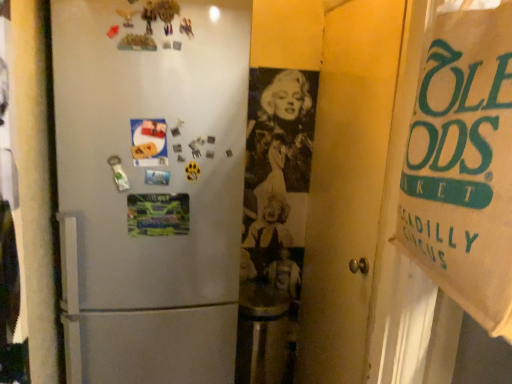
Question: Would you say matte paper postcard at center left, the second postcard positioned from the bottom, is part of brown paper bag at right's contents?

Choices:
 (A) no
 (B) yes

Answer: (A)

Question: Does brown paper bag at right turn towards matte paper postcard at center left, the second postcard positioned from the bottom?

Choices:
 (A) yes
 (B) no

Answer: (B)

Question: Is brown paper bag at right positioned with its back to matte paper postcard at center left, arranged as the 1th postcard when viewed from the top?

Choices:
 (A) no
 (B) yes

Answer: (A)

Question: Is brown paper bag at right to the right of matte paper postcard at center left, arranged as the 1th postcard when viewed from the top, from the viewer's perspective?

Choices:
 (A) yes
 (B) no

Answer: (A)

Question: From a real-world perspective, is brown paper bag at right positioned under matte paper postcard at center left, the second postcard positioned from the bottom, based on gravity?

Choices:
 (A) yes
 (B) no

Answer: (B)

Question: Considering the positions of multicolored paper at center, which is the 1th postcard in bottom-to-top order, and matte paper postcard at center left, the second postcard positioned from the bottom, in the image, is multicolored paper at center, which is the 1th postcard in bottom-to-top order, wider or thinner than matte paper postcard at center left, the second postcard positioned from the bottom,?

Choices:
 (A) wide
 (B) thin

Answer: (B)

Question: Is multicolored paper at center, which is counted as the second postcard, starting from the top, in front of or behind matte paper postcard at center left, arranged as the 1th postcard when viewed from the top, in the image?

Choices:
 (A) front
 (B) behind

Answer: (B)

Question: Is multicolored paper at center, which is counted as the second postcard, starting from the top, to the left or to the right of matte paper postcard at center left, the second postcard positioned from the bottom, in the image?

Choices:
 (A) left
 (B) right

Answer: (B)

Question: Is multicolored paper at center, which is the 1th postcard in bottom-to-top order, taller or shorter than matte paper postcard at center left, arranged as the 1th postcard when viewed from the top?

Choices:
 (A) short
 (B) tall

Answer: (A)

Question: From the image's perspective, is matte paper postcard at center left, arranged as the 1th postcard when viewed from the top, positioned above or below multicolored paper at center, which is the 1th postcard in bottom-to-top order?

Choices:
 (A) below
 (B) above

Answer: (B)

Question: In terms of width, does matte paper postcard at center left, arranged as the 1th postcard when viewed from the top, look wider or thinner when compared to multicolored paper at center, which is the 1th postcard in bottom-to-top order?

Choices:
 (A) wide
 (B) thin

Answer: (A)

Question: Is matte paper postcard at center left, arranged as the 1th postcard when viewed from the top, in front of or behind multicolored paper at center, which is counted as the second postcard, starting from the top, in the image?

Choices:
 (A) front
 (B) behind

Answer: (A)

Question: In the image, is matte paper postcard at center left, the second postcard positioned from the bottom, on the left side or the right side of multicolored paper at center, which is counted as the second postcard, starting from the top?

Choices:
 (A) right
 (B) left

Answer: (B)

Question: From the image's perspective, relative to matte paper postcard at center left, the second postcard positioned from the bottom, is brown paper bag at right above or below?

Choices:
 (A) below
 (B) above

Answer: (A)

Question: Considering the relative positions of brown paper bag at right and matte paper postcard at center left, the second postcard positioned from the bottom, in the image provided, is brown paper bag at right to the left or to the right of matte paper postcard at center left, the second postcard positioned from the bottom,?

Choices:
 (A) right
 (B) left

Answer: (A)